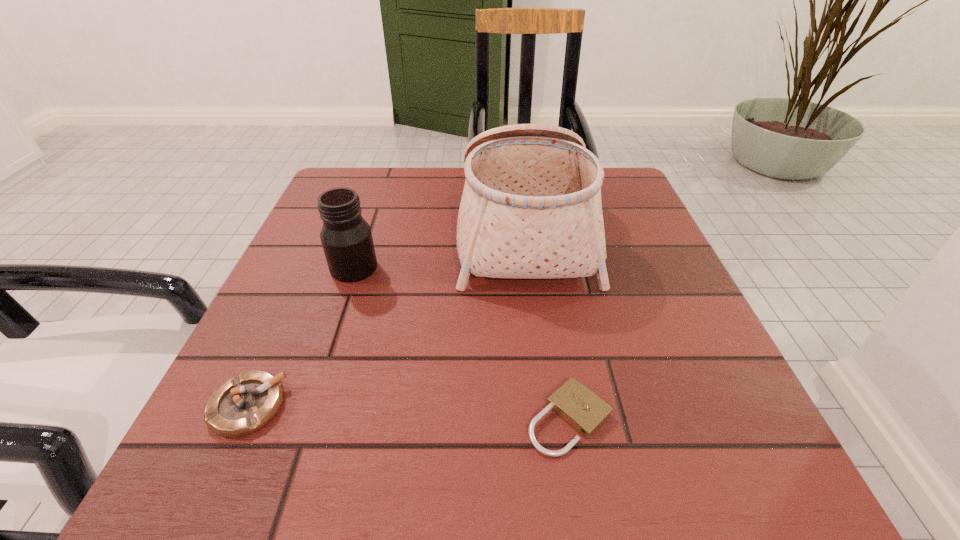
You are a GUI agent. You are given a task and a screenshot of the screen. Output one action in this format:
    pyautogui.click(x=<x>, y=<y>)
    Task: Click on the vacant space that satisfies the following two spatial constraints: 1. with the lid open on the padlock; 2. on the right side of the basket
    The image size is (960, 540).
    Given the screenshot: What is the action you would take?
    pyautogui.click(x=549, y=418)

I want to click on vacant area that satisfies the following two spatial constraints: 1. on the back side of the jar; 2. on the right side of the ashtray, so click(310, 268).

Find the location of a particular element. The height and width of the screenshot is (540, 960). free space that satisfies the following two spatial constraints: 1. on the front side of the padlock; 2. on the right side of the ashtray is located at coordinates click(242, 418).